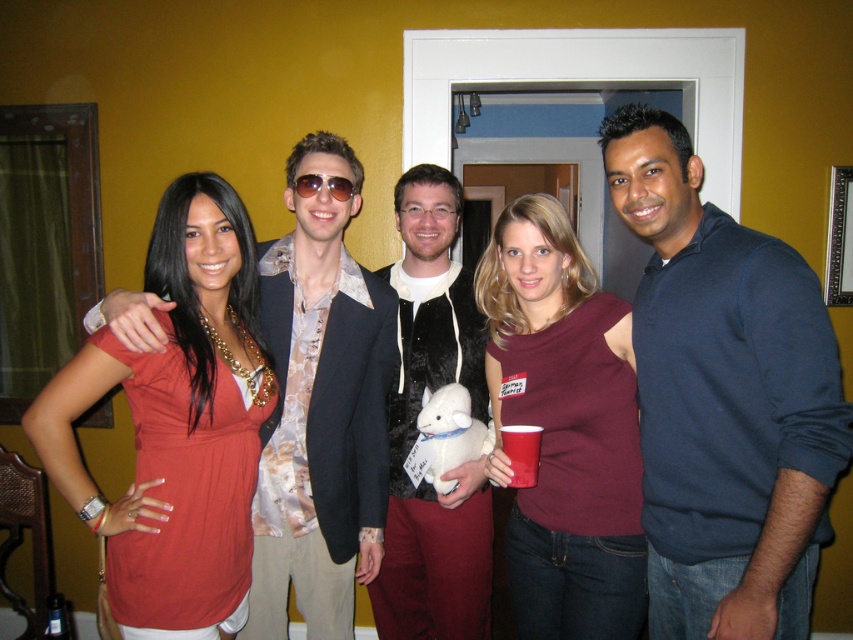
Is the position of dark blue sweater at center less distant than that of maroon sleeveless top at center?

Yes.

The image size is (853, 640). What do you see at coordinates (724, 397) in the screenshot? I see `dark blue sweater at center` at bounding box center [724, 397].

Which is behind, point (708, 376) or point (583, 417)?

Point (583, 417)

Where is `dark blue sweater at center`? dark blue sweater at center is located at coordinates (724, 397).

Does maroon sleeveless top at center appear under fuzzy black vest at center?

No.

Is maroon sleeveless top at center wider than fuzzy black vest at center?

Indeed, maroon sleeveless top at center has a greater width compared to fuzzy black vest at center.

The width and height of the screenshot is (853, 640). Find the location of `maroon sleeveless top at center`. maroon sleeveless top at center is located at coordinates (566, 428).

Find the location of a particular element. The width and height of the screenshot is (853, 640). maroon sleeveless top at center is located at coordinates (566, 428).

Is the position of matte orange blouse at center more distant than that of shiny metallic jacket at center?

No, it is not.

Which is more to the right, matte orange blouse at center or shiny metallic jacket at center?

From the viewer's perspective, shiny metallic jacket at center appears more on the right side.

Is point (148, 481) positioned before point (318, 444)?

Yes, point (148, 481) is in front of point (318, 444).

At what (x,y) coordinates should I click in order to perform the action: click on matte orange blouse at center. Please return your answer as a coordinate pair (x, y). The image size is (853, 640). Looking at the image, I should click on (177, 422).